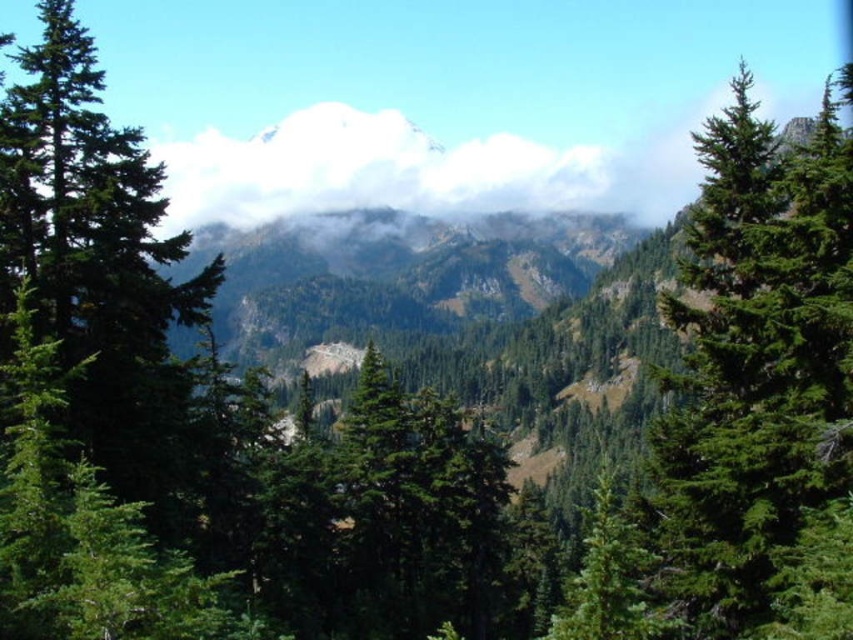
Is green needle-like tree at right smaller than white fluffy cloud at center?

Correct, green needle-like tree at right occupies less space than white fluffy cloud at center.

Looking at this image, who is more forward, [764,381] or [496,180]?

Point [764,381]

Locate an element on the screen. The height and width of the screenshot is (640, 853). green needle-like tree at right is located at coordinates (756, 362).